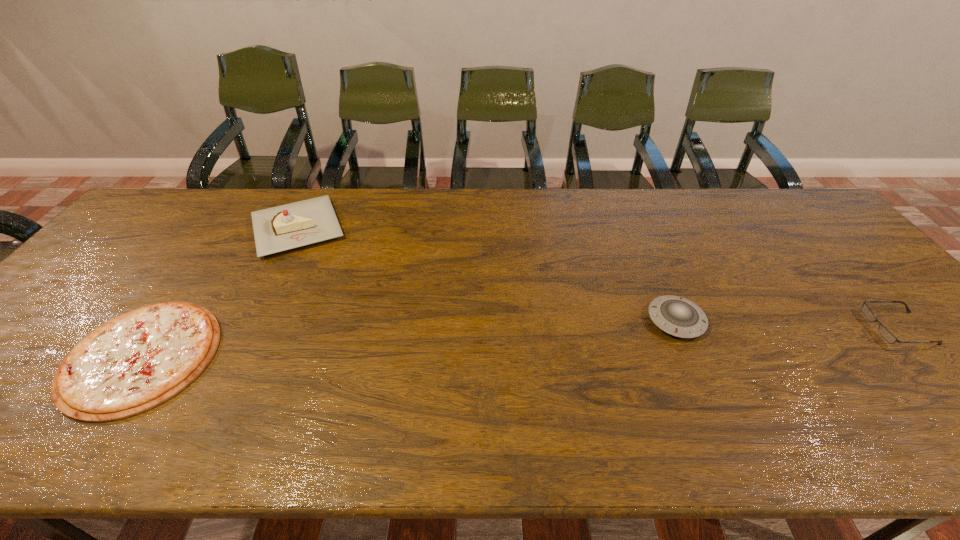
Where is `vacant region located 0.160m on the front-facing side of the rightmost object`? The width and height of the screenshot is (960, 540). vacant region located 0.160m on the front-facing side of the rightmost object is located at coordinates (806, 328).

At what (x,y) coordinates should I click in order to perform the action: click on vacant area located on the front-facing side of the rightmost object. Please return your answer as a coordinate pair (x, y). The width and height of the screenshot is (960, 540). Looking at the image, I should click on (709, 328).

At what (x,y) coordinates should I click in order to perform the action: click on vacant space located on the right of the shortest object. Please return your answer as a coordinate pair (x, y). The width and height of the screenshot is (960, 540). Looking at the image, I should click on (278, 356).

This screenshot has height=540, width=960. Find the location of `object that is at the far edge`. object that is at the far edge is located at coordinates (293, 225).

Where is `object that is at the near edge`? The image size is (960, 540). object that is at the near edge is located at coordinates (136, 361).

Where is `object situated at the left edge`? The width and height of the screenshot is (960, 540). object situated at the left edge is located at coordinates (136, 361).

Find the location of a particular element. Image resolution: width=960 pixels, height=540 pixels. object that is positioned at the right edge is located at coordinates (884, 332).

The width and height of the screenshot is (960, 540). What are the coordinates of `object situated at the near left corner` in the screenshot? It's located at (136, 361).

At what (x,y) coordinates should I click in order to perform the action: click on vacant area at the far edge of the desktop. Please return your answer as a coordinate pair (x, y). Looking at the image, I should click on (484, 222).

Image resolution: width=960 pixels, height=540 pixels. Find the location of `blank space at the near edge`. blank space at the near edge is located at coordinates (736, 448).